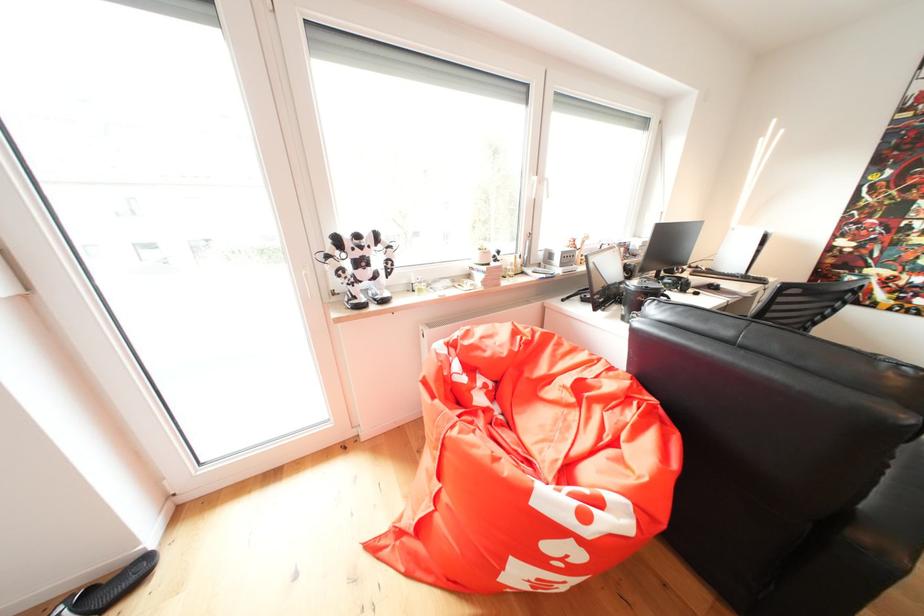
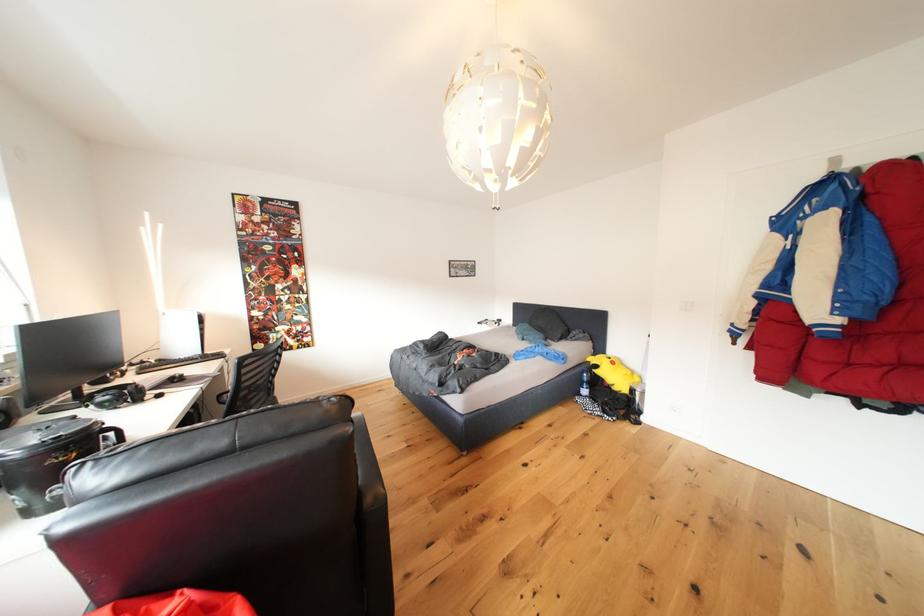
Question: The camera is either moving clockwise (left) or counter-clockwise (right) around the object. The first image is from the beginning of the video and the second image is from the end. Is the camera moving left or right when shooting the video?

Choices:
 (A) Left
 (B) Right

Answer: (A)